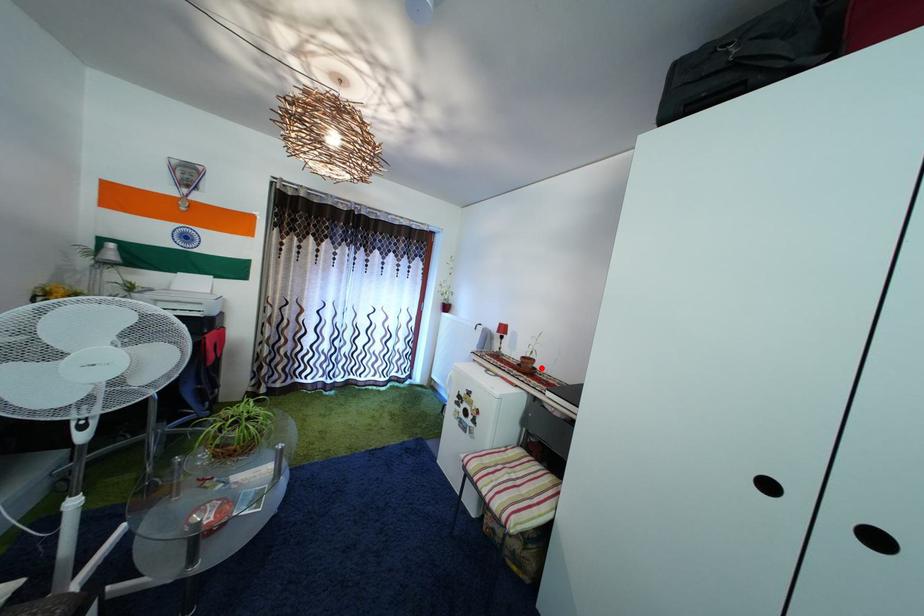
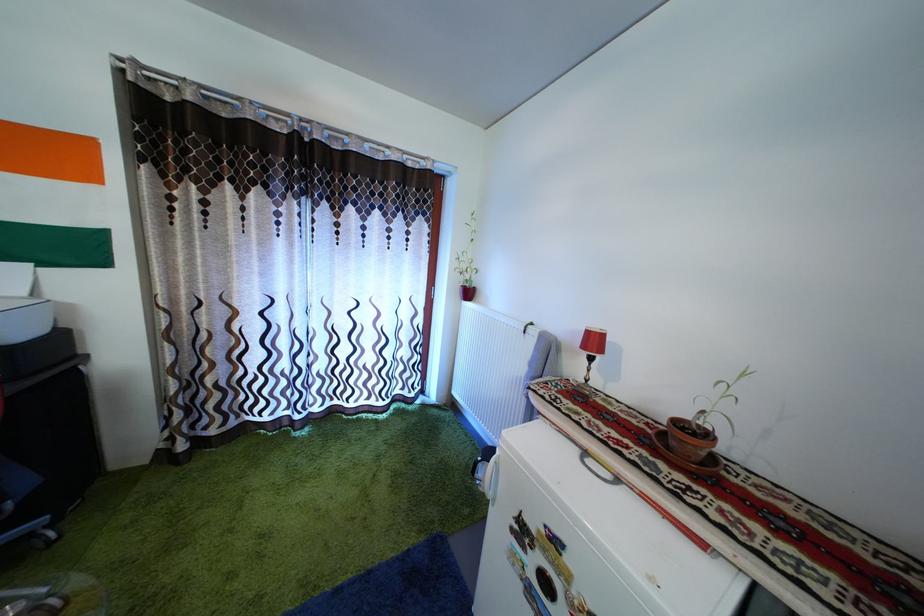
Where in the second image is the point corresponding to the highlighted location from the first image?

(715, 442)